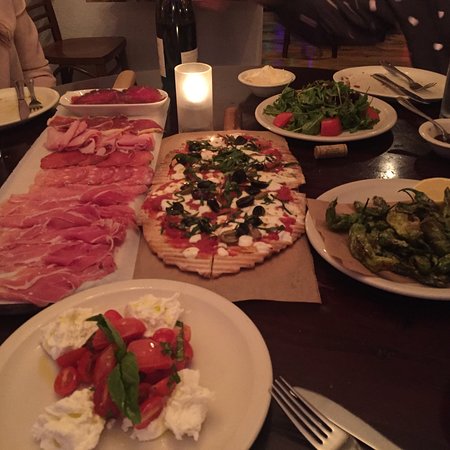
You are a GUI agent. You are given a task and a screenshot of the screen. Output one action in this format:
    pyautogui.click(x=<x>, y=<y>)
    Task: Click on the wine bottle
    The image size is (450, 450).
    Given the screenshot: What is the action you would take?
    pyautogui.click(x=173, y=26)